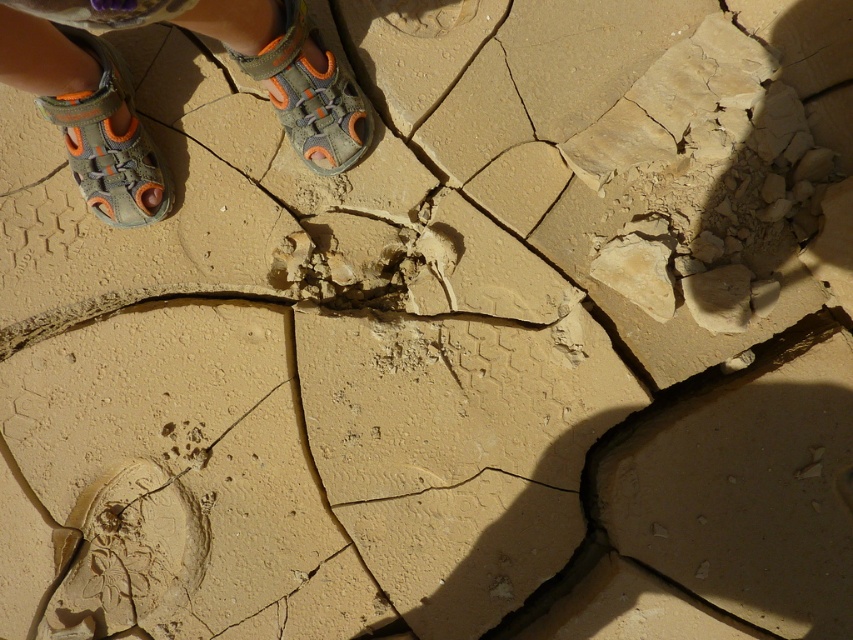
You are standing on the cracked dry surface and want to move to a safer area. Where should you step to avoid the gray fabric sandals at upper left?

You should step away from the gray fabric sandals at upper left, which are located at the upper left corner of the scene, to avoid them and find a safer area.

You are standing on the cracked surface and looking at the gray fabric sandals at upper left and the gray fabric sandal at left. Which one is taller?

The gray fabric sandals at upper left is taller than the gray fabric sandal at left.